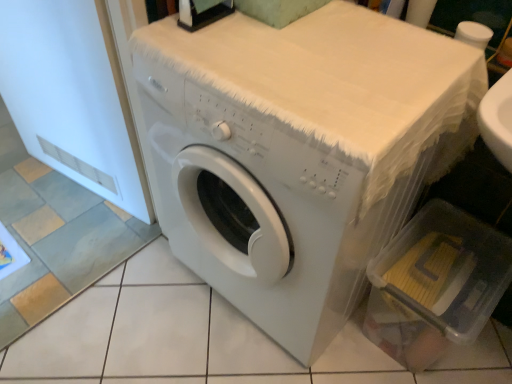
The image size is (512, 384). Identify the location of vacant point above white matte washing machine at center (from a real-world perspective). (296, 49).